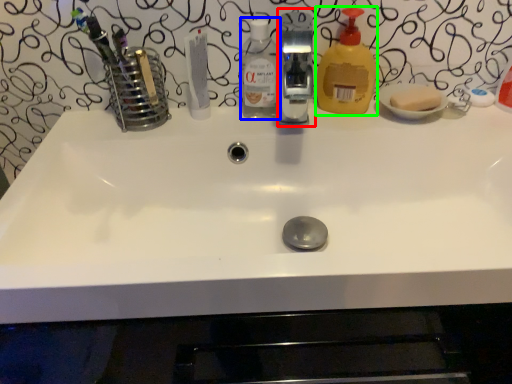
Question: Which object is positioned farthest from fixture (highlighted by a red box)? Select from bottle (highlighted by a blue box) and cleaning product (highlighted by a green box).

Choices:
 (A) bottle
 (B) cleaning product

Answer: (A)